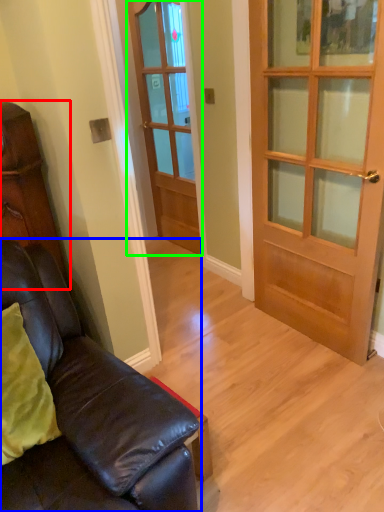
Question: Based on their relative distances, which object is farther from cabinetry (highlighted by a red box)? Choose from studio couch (highlighted by a blue box) and door (highlighted by a green box).

Choices:
 (A) studio couch
 (B) door

Answer: (B)